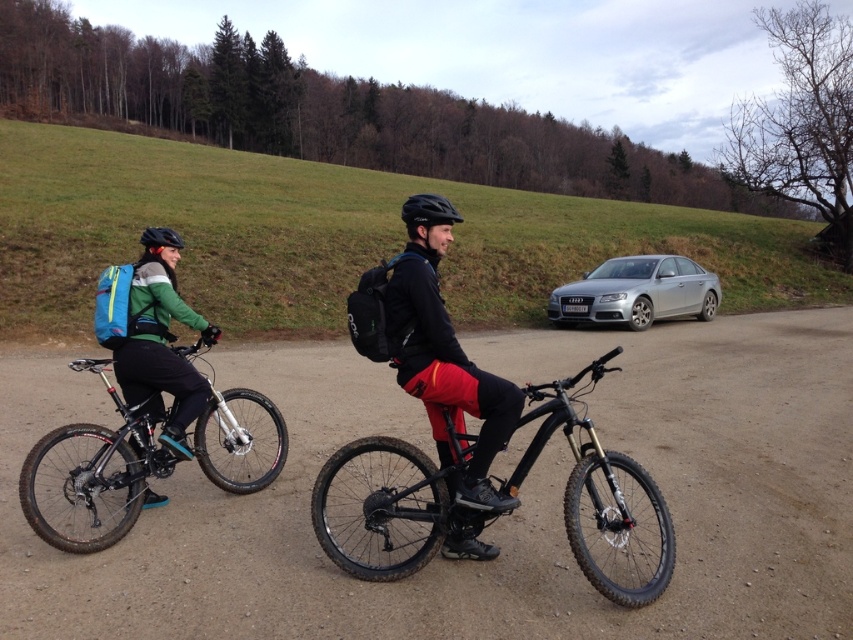
Question: Which point appears closest to the camera in this image?

Choices:
 (A) (144, 228)
 (B) (198, 392)

Answer: (B)

Question: Among these points, which one is nearest to the camera?

Choices:
 (A) (148, 298)
 (B) (426, 339)
 (C) (596, 289)
 (D) (91, 497)

Answer: (B)

Question: Is matte black jacket at center bigger than teal fabric backpack at left?

Choices:
 (A) yes
 (B) no

Answer: (A)

Question: Which point is closer to the camera taking this photo?

Choices:
 (A) (331, 556)
 (B) (47, 467)
 (C) (486, 502)

Answer: (C)

Question: Can you confirm if black rubber bicycle at center is positioned to the left of matte black jacket at center?

Choices:
 (A) no
 (B) yes

Answer: (A)

Question: Does black rubber bicycle at center appear under matte black jacket at center?

Choices:
 (A) yes
 (B) no

Answer: (A)